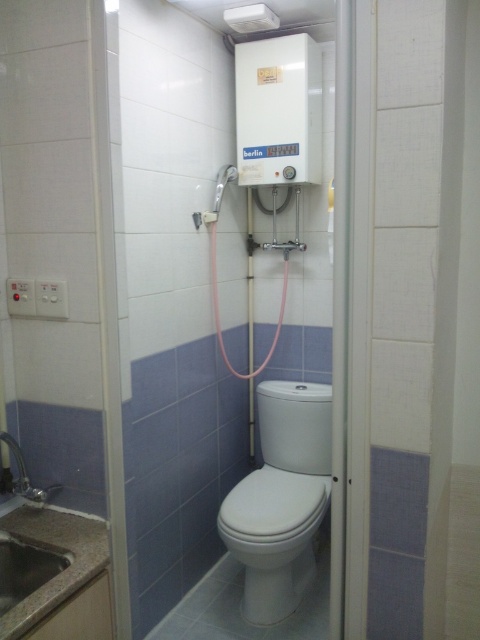
Question: Which point is closer to the camera?

Choices:
 (A) matte white shower at upper center
 (B) white glossy toilet at center

Answer: (B)

Question: Is white glossy toilet at center wider than granite sink at lower left?

Choices:
 (A) yes
 (B) no

Answer: (A)

Question: Observing the image, what is the correct spatial positioning of white glossy toilet at center in reference to matte white shower at upper center?

Choices:
 (A) above
 (B) below

Answer: (B)

Question: Can you confirm if granite sink at lower left is positioned to the right of matte white shower at upper center?

Choices:
 (A) no
 (B) yes

Answer: (A)

Question: Based on their relative distances, which object is nearer to the granite sink at lower left?

Choices:
 (A) white glossy toilet at center
 (B) matte white shower at upper center

Answer: (A)

Question: Which object is closer to the camera taking this photo?

Choices:
 (A) white glossy toilet at center
 (B) granite sink at lower left

Answer: (B)